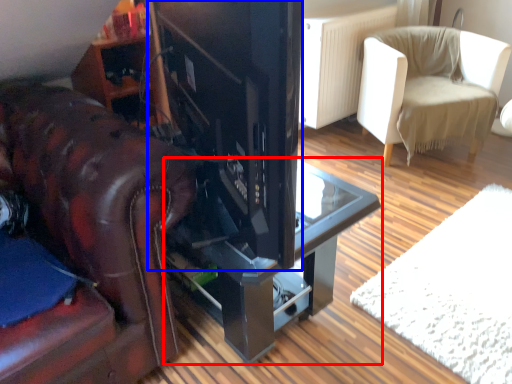
Question: Which of the following is the closest to the observer, table (highlighted by a red box) or appliance (highlighted by a blue box)?

Choices:
 (A) table
 (B) appliance

Answer: (B)